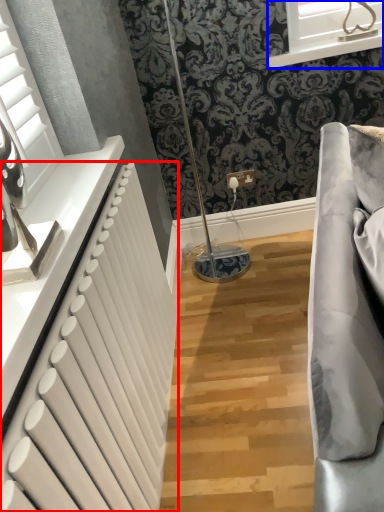
Question: Which point is closer to the camera, radiator (highlighted by a red box) or window (highlighted by a blue box)?

Choices:
 (A) radiator
 (B) window

Answer: (A)